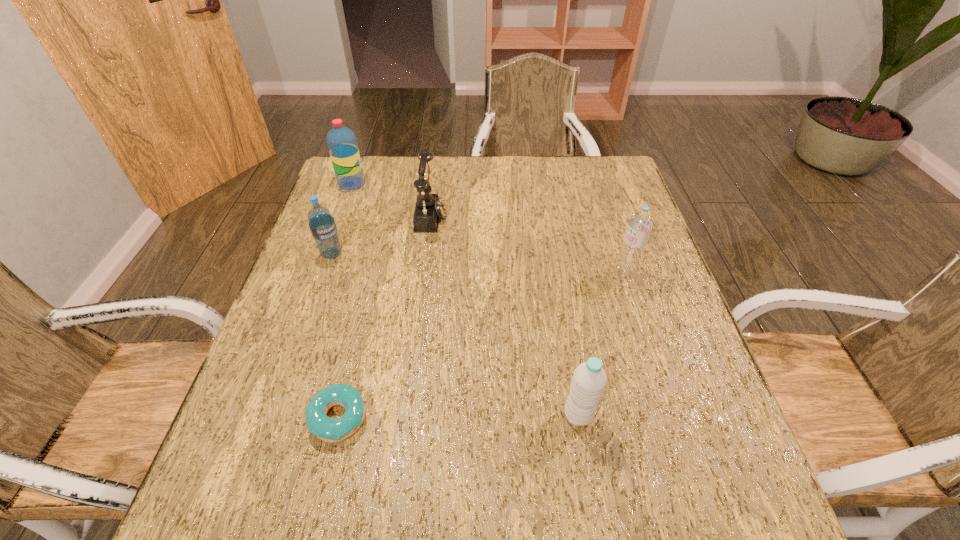
Locate an element on the screen. the third closest water bottle to the fourth object from left to right is located at coordinates (640, 223).

Find the location of a particular element. The height and width of the screenshot is (540, 960). the closest water bottle to the fourth nearest object is located at coordinates click(342, 144).

At what (x,y) coordinates should I click in order to perform the action: click on vacant region that satisfies the following two spatial constraints: 1. on the dial of the telephone; 2. on the left side of the second nearest water bottle. Please return your answer as a coordinate pair (x, y). The height and width of the screenshot is (540, 960). Looking at the image, I should click on [x=424, y=273].

This screenshot has height=540, width=960. Find the location of `free space that satisfies the following two spatial constraints: 1. on the dial of the third object from right to left; 2. on the right side of the rightmost water bottle`. free space that satisfies the following two spatial constraints: 1. on the dial of the third object from right to left; 2. on the right side of the rightmost water bottle is located at coordinates (424, 273).

Locate an element on the screen. This screenshot has height=540, width=960. free space that satisfies the following two spatial constraints: 1. on the front label of the doughnut; 2. on the right side of the farthest water bottle is located at coordinates (270, 418).

The width and height of the screenshot is (960, 540). I want to click on vacant space that satisfies the following two spatial constraints: 1. on the front label of the farthest water bottle; 2. on the back side of the rightmost water bottle, so click(x=321, y=273).

Find the location of a particular element. This screenshot has width=960, height=540. vacant region that satisfies the following two spatial constraints: 1. on the front label of the second object from right to left; 2. on the right side of the farthest object is located at coordinates (271, 415).

The width and height of the screenshot is (960, 540). I want to click on free spot that satisfies the following two spatial constraints: 1. on the front label of the fourth farthest object; 2. on the right side of the farthest object, so click(x=321, y=273).